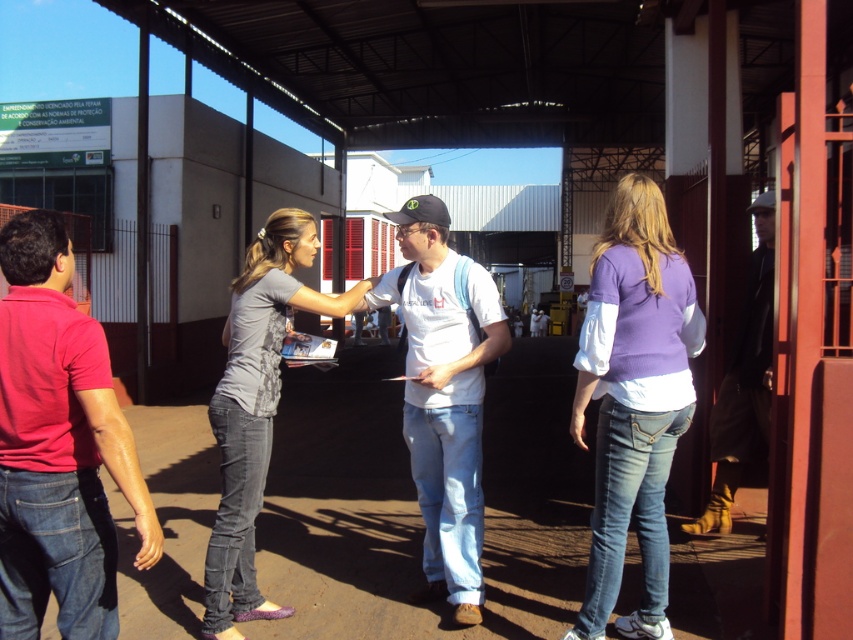
You are organizing a clothing donation drive and need to categorize items by size. If you have a matte red shirt at left and a purple knit sweater at center, which one would you place in the small size bin?

The matte red shirt at left has a smaller size compared to the purple knit sweater at center, so it should be placed in the small size bin.

From the picture: You are standing in the market area and see the matte red shirt at left and the purple knit sweater at center. Which one is positioned more to the left side of the scene?

The matte red shirt at left is positioned more to the left side of the scene than the purple knit sweater at center.